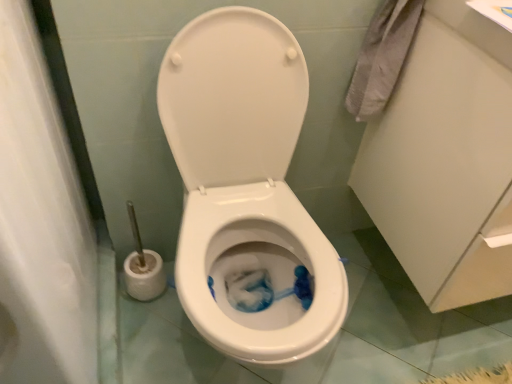
What do you see at coordinates (245, 183) in the screenshot? I see `white glossy toilet at center` at bounding box center [245, 183].

In order to face white glossy toilet at center, should I rotate leftwards or rightwards?

You should look left and rotate roughly 0.143 degrees.

Find the location of a particular element. This screenshot has width=512, height=384. white glossy toilet at center is located at coordinates (245, 183).

Identify the location of white glossy toilet at center. (245, 183).